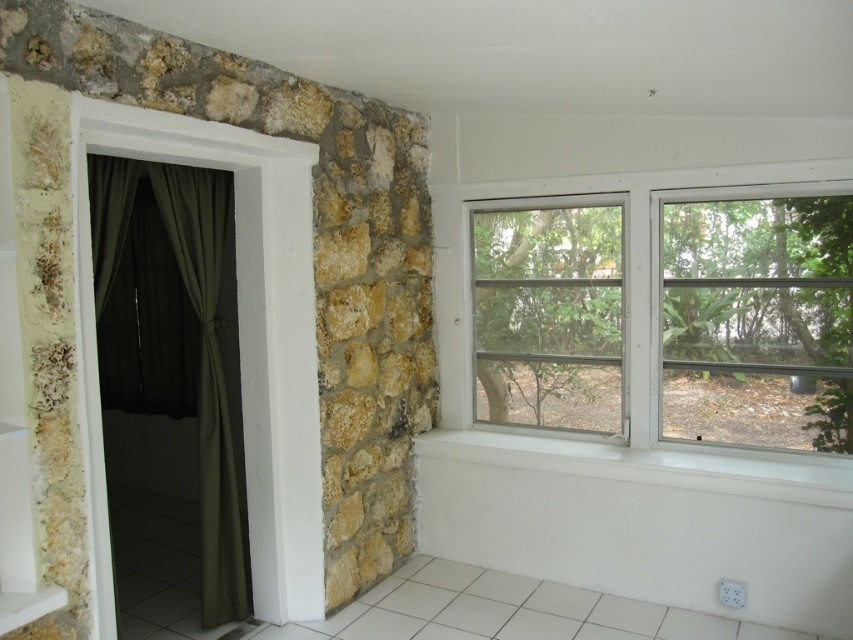
You are trying to decide whether to open the clear glass window at upper right or the green fabric curtain at left to let in more light. Based on their sizes, which one allows more light to enter?

The clear glass window at upper right has a lesser height compared to the green fabric curtain at left, so the green fabric curtain at left would allow more light to enter because it is taller.

You are standing in the room and want to see outside through the clear glass window at upper right. Is the green fabric curtain at left blocking your view?

The clear glass window at upper right is positioned under the green fabric curtain at left, so the curtain is blocking the view of the window.

You are standing in the room and want to look outside through the clear glass window at upper right. Is the green fabric curtain at left blocking your view of the window?

The clear glass window at upper right is closer to the viewer than the green fabric curtain at left, so the curtain is behind the window and does not block the view.